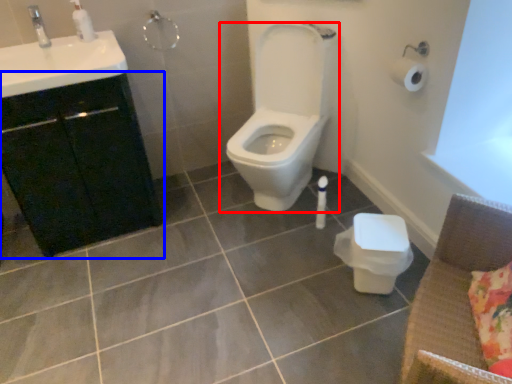
Question: Among these objects, which one is nearest to the camera, toilet (highlighted by a red box) or bathroom cabinet (highlighted by a blue box)?

Choices:
 (A) toilet
 (B) bathroom cabinet

Answer: (B)